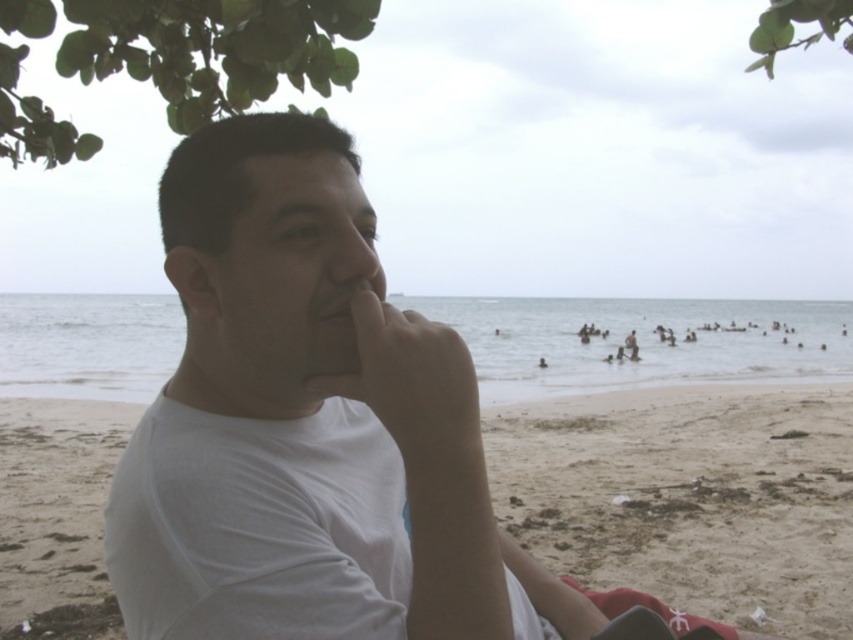
Question: From the image, what is the correct spatial relationship of green leafy tree at upper left in relation to green leafy tree at upper right?

Choices:
 (A) above
 (B) below

Answer: (B)

Question: Which object is farther from the camera taking this photo?

Choices:
 (A) green leafy tree at upper left
 (B) white matte t-shirt at center

Answer: (A)

Question: Does white matte t-shirt at center have a smaller size compared to green leafy tree at upper right?

Choices:
 (A) yes
 (B) no

Answer: (A)

Question: Which is nearer to the white fabric at center?

Choices:
 (A) green leafy tree at upper right
 (B) white matte t-shirt at center
 (C) green leafy tree at upper left

Answer: (B)

Question: Which object appears closest to the camera in this image?

Choices:
 (A) green leafy tree at upper right
 (B) green leafy tree at upper left

Answer: (B)

Question: Is green leafy tree at upper left wider than green leafy tree at upper right?

Choices:
 (A) yes
 (B) no

Answer: (B)